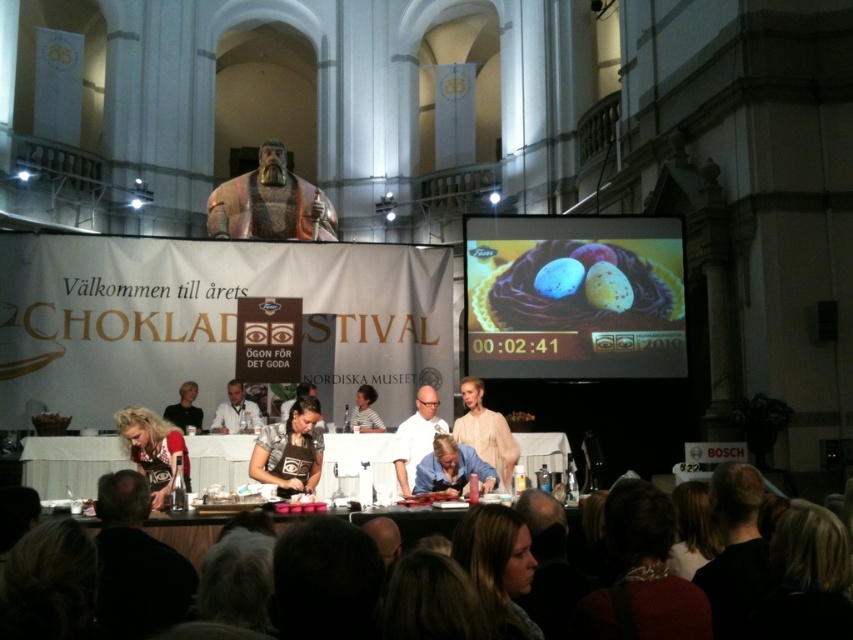
Question: Is matte black apron at center bigger than dark brown leather jacket at lower center?

Choices:
 (A) yes
 (B) no

Answer: (B)

Question: Which object appears farthest from the camera in this image?

Choices:
 (A) blonde hair at lower left
 (B) white glossy chef coat at center

Answer: (B)

Question: Which object appears closest to the camera in this image?

Choices:
 (A) gold textured statue at upper center
 (B) matte black apron at center

Answer: (B)

Question: Considering the relative positions of dark brown leather jacket at lower center and blonde hair at lower left in the image provided, where is dark brown leather jacket at lower center located with respect to blonde hair at lower left?

Choices:
 (A) below
 (B) above

Answer: (A)

Question: From the image, what is the correct spatial relationship of dark brown leather jacket at lower center in relation to white glossy chef coat at center?

Choices:
 (A) below
 (B) above

Answer: (A)

Question: Which point is closer to the camera taking this photo?

Choices:
 (A) (178, 540)
 (B) (292, 404)
 (C) (328, 442)
 (D) (483, 477)

Answer: (A)